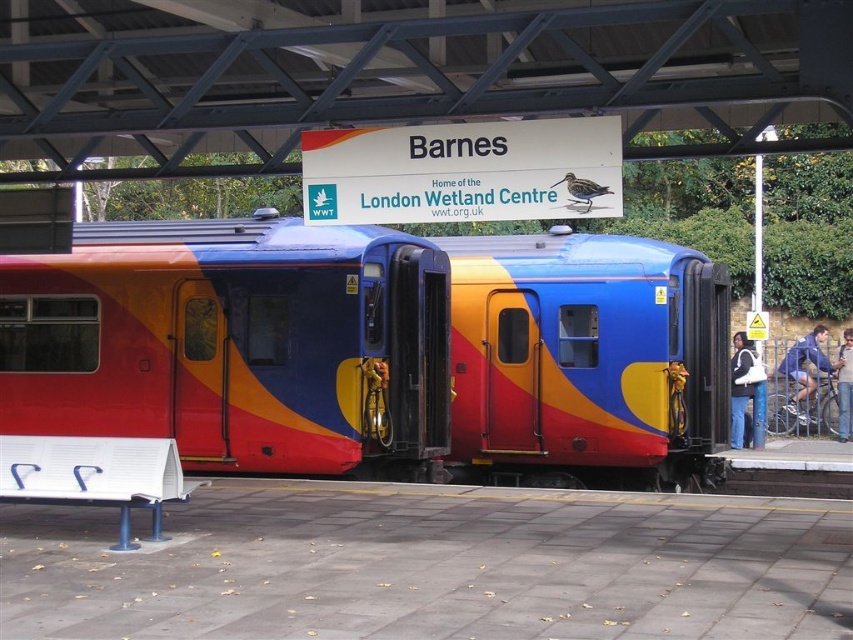
Question: Which point is farther to the camera?

Choices:
 (A) (73, 333)
 (B) (762, 372)
 (C) (804, 422)

Answer: (C)

Question: Which object is farther from the camera taking this photo?

Choices:
 (A) blue denim jacket at right
 (B) matte plastic train at center

Answer: (A)

Question: Where is matte plastic train at center located in relation to matte black jacket at lower right in the image?

Choices:
 (A) right
 (B) left

Answer: (B)

Question: Considering the relative positions of blue denim jacket at right and matte black jacket at lower right in the image provided, where is blue denim jacket at right located with respect to matte black jacket at lower right?

Choices:
 (A) right
 (B) left

Answer: (A)

Question: Which point appears closest to the camera in this image?

Choices:
 (A) (405, 433)
 (B) (836, 378)
 (C) (788, 369)

Answer: (A)

Question: Can you confirm if matte plastic train at center is positioned above denim jacket at right?

Choices:
 (A) no
 (B) yes

Answer: (B)